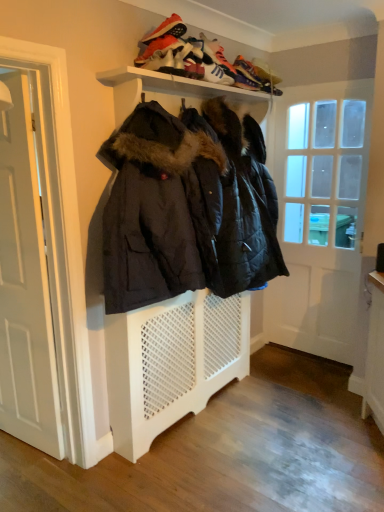
This screenshot has width=384, height=512. In order to click on vacant region under matte black jackets at center (from a real-world perspective) in this screenshot , I will do tap(234, 410).